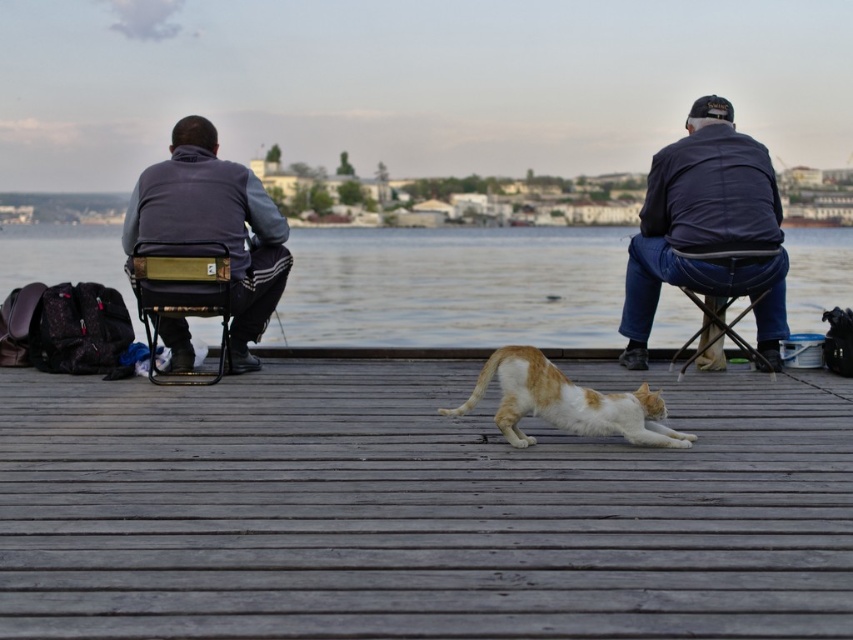
Can you confirm if transparent water at center is positioned to the right of metallic gold chair at left?

Indeed, transparent water at center is positioned on the right side of metallic gold chair at left.

Does transparent water at center appear under metallic gold chair at left?

Actually, transparent water at center is above metallic gold chair at left.

You are a GUI agent. You are given a task and a screenshot of the screen. Output one action in this format:
    pyautogui.click(x=<x>, y=<y>)
    Task: Click on the transparent water at center
    
    Given the screenshot: What is the action you would take?
    pyautogui.click(x=456, y=285)

Who is higher up, wooden dock at center or transparent water at center?

transparent water at center

Is wooden dock at center positioned before transparent water at center?

Yes, it is in front of transparent water at center.

Identify the location of wooden dock at center. The width and height of the screenshot is (853, 640). (418, 508).

Which is behind, point (143, 234) or point (743, 316)?

Positioned behind is point (743, 316).

Between point (132, 218) and point (694, 280), which one is positioned in front?

Positioned in front is point (694, 280).

Identify the location of matte gray jacket at left. The width and height of the screenshot is (853, 640). (213, 225).